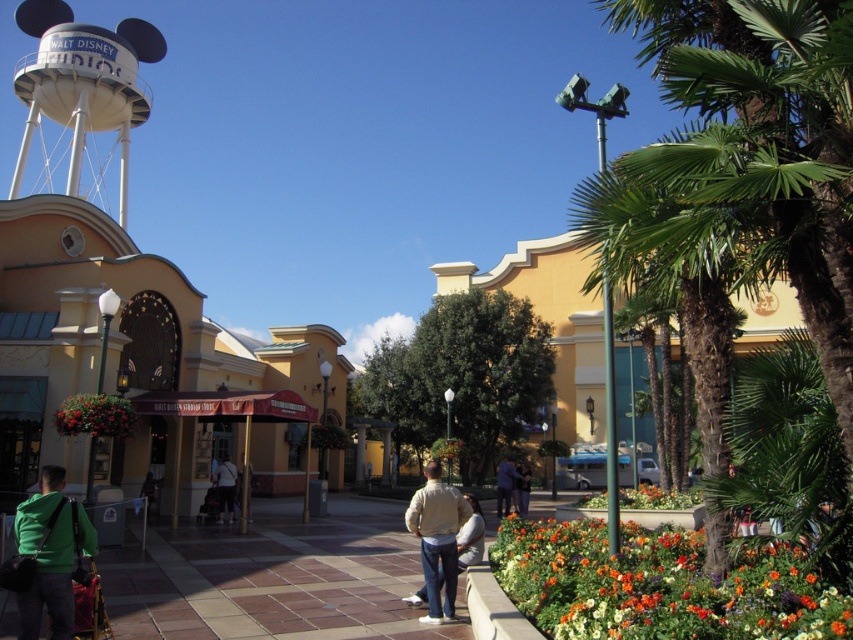
Question: Where is green matte jacket at lower left located in relation to dark blue shirt at center in the image?

Choices:
 (A) right
 (B) left

Answer: (B)

Question: Which object is closer to the camera taking this photo?

Choices:
 (A) white matte water tower at upper left
 (B) bright multicolored petals at lower right
 (C) green leafy palm tree at center right

Answer: (B)

Question: Does light beige sweater at center appear on the right side of dark blue shirt at center?

Choices:
 (A) yes
 (B) no

Answer: (B)

Question: Which point appears closest to the camera in this image?

Choices:
 (A) (621, 560)
 (B) (735, 236)
 (C) (503, 496)

Answer: (B)

Question: Which point is farther to the camera?

Choices:
 (A) click(x=73, y=618)
 (B) click(x=448, y=566)

Answer: (B)

Question: Does light beige sweater at center come in front of vivid red flowers at center?

Choices:
 (A) yes
 (B) no

Answer: (A)